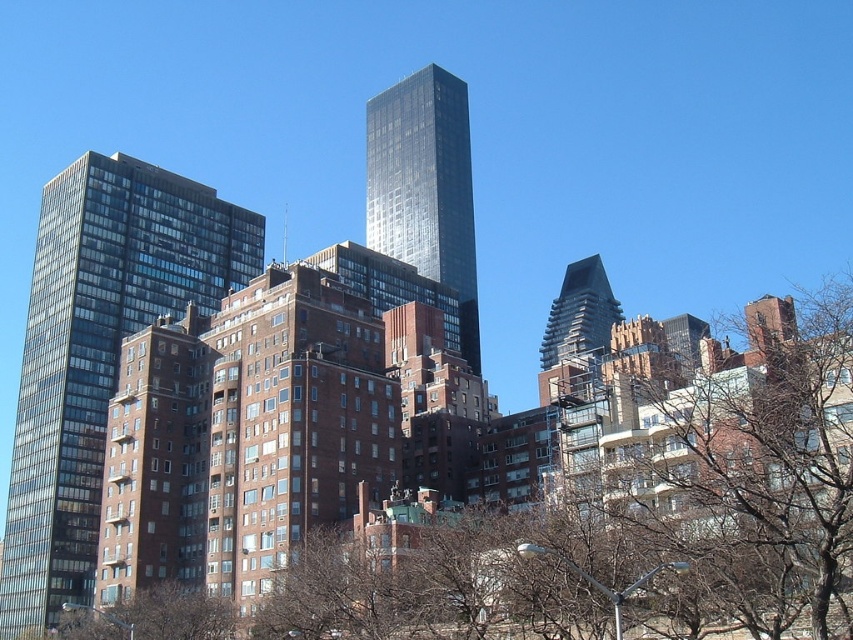
Which is below, glassy reflective building at left or shiny glass skyscraper at center?

Positioned lower is glassy reflective building at left.

Which is more to the left, glassy reflective building at left or shiny glass skyscraper at center?

From the viewer's perspective, glassy reflective building at left appears more on the left side.

Measure the distance between point (218, 200) and camera.

Point (218, 200) and camera are 123.57 meters apart.

Where is `glassy reflective building at left`? The height and width of the screenshot is (640, 853). glassy reflective building at left is located at coordinates (97, 352).

Can you confirm if brown leafless tree at center is wider than glassy reflective building at left?

Yes.

Does point (148, 483) come closer to viewer compared to point (48, 328)?

Yes, it is in front of point (48, 328).

The image size is (853, 640). I want to click on brown leafless tree at center, so click(280, 484).

At what (x,y) coordinates should I click in order to perform the action: click on brown leafless tree at center. Please return your answer as a coordinate pair (x, y). This screenshot has height=640, width=853. Looking at the image, I should click on (280, 484).

Who is higher up, brown leafless tree at center or shiny glass skyscraper at center?

shiny glass skyscraper at center is higher up.

Which is behind, point (833, 397) or point (471, 285)?

Positioned behind is point (471, 285).

Where is `brown leafless tree at center`? The width and height of the screenshot is (853, 640). brown leafless tree at center is located at coordinates (280, 484).